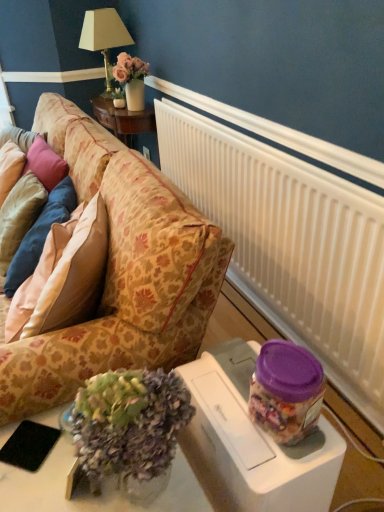
I want to click on vacant region in front of black matte pad at lower left, so click(x=28, y=489).